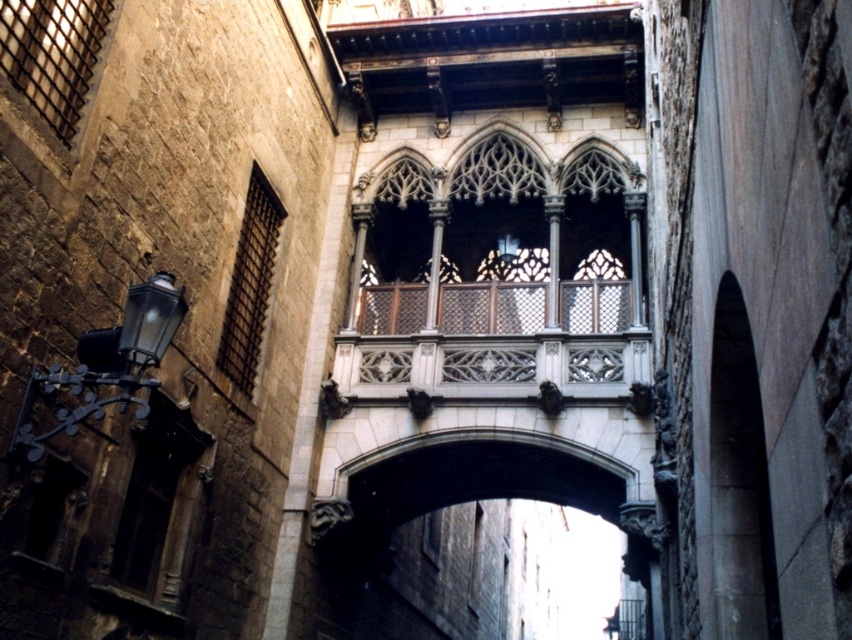
You are a tourist standing in the alleyway and want to take a photo of the white stone balcony at center and the smooth stone archway at center. Which one is above the other?

The white stone balcony at center is positioned over the smooth stone archway at center, so the white stone balcony at center is above the smooth stone archway at center.

You are standing in the alleyway and want to take a photo of the white stone balcony at center. Where should you position yourself to capture it in the frame?

To capture the white stone balcony at center in the frame, position yourself directly in front of it at point [498,273].

In the scene shown: You are an architect examining the historic alleyway. You notice the white stone balcony at center and the smooth stone archway at center. Which of these two structures is closer to your current position?

The white stone balcony at center is closer to you because it is positioned further to the viewer than the smooth stone archway at center.